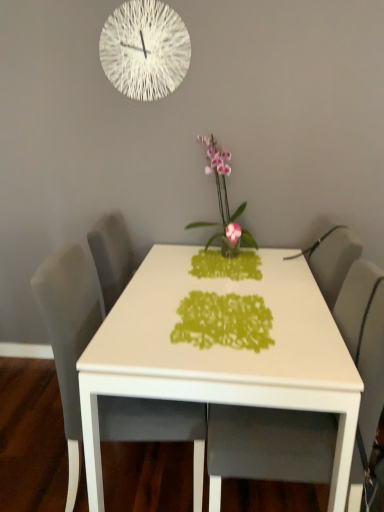
Describe the element at coordinates (223, 321) in the screenshot. I see `green paper cutout at center` at that location.

Where is `green paper cutout at center`? Image resolution: width=384 pixels, height=512 pixels. green paper cutout at center is located at coordinates (223, 321).

Where is `gray fabric chair at left, placed as the 2th chair when sorted from right to left`? The width and height of the screenshot is (384, 512). gray fabric chair at left, placed as the 2th chair when sorted from right to left is located at coordinates (68, 335).

In order to face pink glossy orchid at center, should I rotate leftwards or rightwards?

You should rotate right by 4.085 degrees.

The height and width of the screenshot is (512, 384). What do you see at coordinates (145, 49) in the screenshot?
I see `white textured clock at upper center` at bounding box center [145, 49].

How much space does gray fabric chair at center, which ranks as the 1th chair in right-to-left order, occupy vertically?

38.49 inches.

The width and height of the screenshot is (384, 512). I want to click on green paper cutout at center, so click(x=223, y=321).

Is white glossy table at center positioned behind green paper cutout at center?

That is False.

From the image's perspective, is white glossy table at center located above or below green paper cutout at center?

Based on their image positions, white glossy table at center is located beneath green paper cutout at center.

Which of these two, white glossy table at center or green paper cutout at center, stands shorter?

green paper cutout at center.

In the scene shown: Between white glossy table at center and green paper cutout at center, which one appears on the left side from the viewer's perspective?

green paper cutout at center is more to the left.

Which object is further away from the camera taking this photo, white glossy table at center or pink glossy orchid at center?

pink glossy orchid at center is further from the camera.

Could you tell me if white glossy table at center is facing pink glossy orchid at center?

No, white glossy table at center is not aimed at pink glossy orchid at center.

How different are the orientations of white glossy table at center and pink glossy orchid at center in degrees?

There is a 0.000109-degree angle between the facing directions of white glossy table at center and pink glossy orchid at center.

Is pink glossy orchid at center located within white glossy table at center?

No, pink glossy orchid at center is not inside white glossy table at center.

Is gray fabric chair at center, which ranks as the 1th chair in right-to-left order, aimed at white glossy table at center?

Yes, gray fabric chair at center, which ranks as the 1th chair in right-to-left order, is facing white glossy table at center.

From a real-world perspective, is gray fabric chair at center, which ranks as the 2th chair in left-to-right order, under white glossy table at center?

No, from a real-world perspective, gray fabric chair at center, which ranks as the 2th chair in left-to-right order, is not below white glossy table at center.

Is gray fabric chair at center, which ranks as the 1th chair in right-to-left order, wider than white glossy table at center?

Incorrect, the width of gray fabric chair at center, which ranks as the 1th chair in right-to-left order, does not surpass that of white glossy table at center.

The image size is (384, 512). In order to click on table that appears above the gray fabric chair at center, which ranks as the 2th chair in left-to-right order (from the image's perspective) in this screenshot , I will do `click(206, 390)`.

From a real-world perspective, is pink glossy orchid at center positioned under green paper cutout at center based on gravity?

Incorrect, from a real-world perspective, pink glossy orchid at center is higher than green paper cutout at center.

From the image's perspective, between pink glossy orchid at center and green paper cutout at center, which one is located above?

pink glossy orchid at center.

Where is `houseplant on the right of green paper cutout at center`? Image resolution: width=384 pixels, height=512 pixels. houseplant on the right of green paper cutout at center is located at coordinates (225, 202).

Is pink glossy orchid at center facing towards green paper cutout at center?

Yes, pink glossy orchid at center faces towards green paper cutout at center.

Between point (148, 348) and point (344, 316), which one is positioned in front?

The point (148, 348) is closer.

Which object is thinner, white glossy table at center or gray fabric chair at center, which ranks as the 2th chair in left-to-right order?

gray fabric chair at center, which ranks as the 2th chair in left-to-right order, is thinner.

In the scene shown: Is the depth of white glossy table at center greater than that of gray fabric chair at center, which ranks as the 2th chair in left-to-right order?

Yes, white glossy table at center is further from the camera.

Is white glossy table at center bigger than gray fabric chair at center, which ranks as the 2th chair in left-to-right order?

Correct, white glossy table at center is larger in size than gray fabric chair at center, which ranks as the 2th chair in left-to-right order.

Is gray fabric chair at left, which is the first chair from left to right, next to gray fabric chair at center, which ranks as the 2th chair in left-to-right order?

No.

Is gray fabric chair at left, which is the first chair from left to right, surrounding gray fabric chair at center, which ranks as the 1th chair in right-to-left order?

No.

Considering the relative positions of gray fabric chair at left, placed as the 2th chair when sorted from right to left, and gray fabric chair at center, which ranks as the 2th chair in left-to-right order, in the image provided, is gray fabric chair at left, placed as the 2th chair when sorted from right to left, to the left of gray fabric chair at center, which ranks as the 2th chair in left-to-right order, from the viewer's perspective?

Indeed, gray fabric chair at left, placed as the 2th chair when sorted from right to left, is positioned on the left side of gray fabric chair at center, which ranks as the 2th chair in left-to-right order.

Considering the relative sizes of gray fabric chair at left, which is the first chair from left to right, and gray fabric chair at center, which ranks as the 2th chair in left-to-right order, in the image provided, is gray fabric chair at left, which is the first chair from left to right, thinner than gray fabric chair at center, which ranks as the 2th chair in left-to-right order,?

No.

Considering the relative sizes of gray fabric chair at center, which ranks as the 1th chair in right-to-left order, and gray fabric chair at left, placed as the 2th chair when sorted from right to left, in the image provided, is gray fabric chair at center, which ranks as the 1th chair in right-to-left order, bigger than gray fabric chair at left, placed as the 2th chair when sorted from right to left,?

Yes, gray fabric chair at center, which ranks as the 1th chair in right-to-left order, is bigger than gray fabric chair at left, placed as the 2th chair when sorted from right to left.

In terms of width, does gray fabric chair at center, which ranks as the 2th chair in left-to-right order, look wider or thinner when compared to gray fabric chair at left, which is the first chair from left to right?

Considering their sizes, gray fabric chair at center, which ranks as the 2th chair in left-to-right order, looks slimmer than gray fabric chair at left, which is the first chair from left to right.

Does gray fabric chair at center, which ranks as the 1th chair in right-to-left order, have a greater height compared to gray fabric chair at left, placed as the 2th chair when sorted from right to left?

Indeed, gray fabric chair at center, which ranks as the 1th chair in right-to-left order, has a greater height compared to gray fabric chair at left, placed as the 2th chair when sorted from right to left.

Would you say gray fabric chair at center, which ranks as the 1th chair in right-to-left order, is a long distance from gray fabric chair at left, placed as the 2th chair when sorted from right to left?

Actually, gray fabric chair at center, which ranks as the 1th chair in right-to-left order, and gray fabric chair at left, placed as the 2th chair when sorted from right to left, are a little close together.

This screenshot has height=512, width=384. In order to click on table below the green paper cutout at center (from a real-world perspective) in this screenshot , I will do `click(206, 390)`.

Identify the location of houseplant behind the white glossy table at center. (225, 202).

Which object lies nearer to the anchor point green paper cutout at center, white textured clock at upper center or gray fabric chair at center, which ranks as the 1th chair in right-to-left order?

Based on the image, gray fabric chair at center, which ranks as the 1th chair in right-to-left order, appears to be nearer to green paper cutout at center.

Looking at the image, which one is located closer to pink glossy orchid at center, green paper cutout at center or gray fabric chair at center, which ranks as the 1th chair in right-to-left order?

green paper cutout at center.

Which object lies further to the anchor point green paper cutout at center, gray fabric chair at center, which ranks as the 1th chair in right-to-left order, or pink glossy orchid at center?

pink glossy orchid at center is further to green paper cutout at center.

Based on their spatial positions, is pink glossy orchid at center or gray fabric chair at left, which is the first chair from left to right, further from green paper cutout at center?

pink glossy orchid at center is further to green paper cutout at center.

Based on their spatial positions, is green paper cutout at center or gray fabric chair at left, which is the first chair from left to right, further from gray fabric chair at center, which ranks as the 1th chair in right-to-left order?

gray fabric chair at left, which is the first chair from left to right, is positioned further to the anchor gray fabric chair at center, which ranks as the 1th chair in right-to-left order.

From the picture: Which object lies nearer to the anchor point white glossy table at center, gray fabric chair at center, which ranks as the 2th chair in left-to-right order, or gray fabric chair at left, which is the first chair from left to right?

gray fabric chair at center, which ranks as the 2th chair in left-to-right order, is positioned closer to the anchor white glossy table at center.

Based on their spatial positions, is white glossy table at center or gray fabric chair at left, which is the first chair from left to right, further from pink glossy orchid at center?

gray fabric chair at left, which is the first chair from left to right, is positioned further to the anchor pink glossy orchid at center.

Considering their positions, is pink glossy orchid at center positioned closer to white textured clock at upper center than gray fabric chair at left, placed as the 2th chair when sorted from right to left?

pink glossy orchid at center lies closer to white textured clock at upper center than the other object.

The width and height of the screenshot is (384, 512). What are the coordinates of `houseplant between white textured clock at upper center and gray fabric chair at left, which is the first chair from left to right, vertically` in the screenshot? It's located at (225, 202).

At what (x,y) coordinates should I click in order to perform the action: click on table located between gray fabric chair at left, which is the first chair from left to right, and gray fabric chair at center, which ranks as the 2th chair in left-to-right order, in the left-right direction. Please return your answer as a coordinate pair (x, y). The image size is (384, 512). Looking at the image, I should click on (206, 390).

This screenshot has height=512, width=384. I want to click on houseplant between white textured clock at upper center and gray fabric chair at center, which ranks as the 1th chair in right-to-left order, vertically, so click(225, 202).

Find the location of a particular element. The width and height of the screenshot is (384, 512). houseplant between white textured clock at upper center and white glossy table at center in the vertical direction is located at coordinates (225, 202).